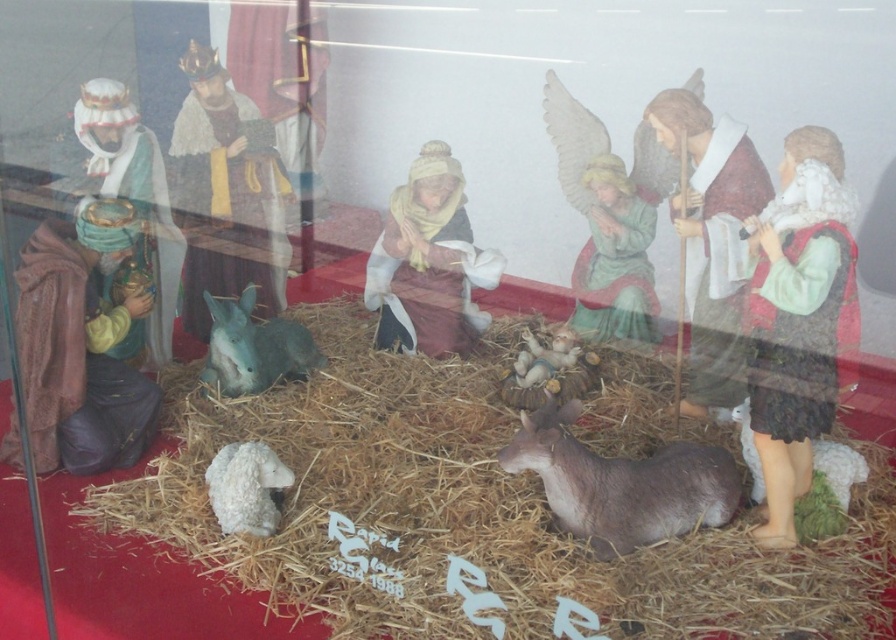
You are a shopkeeper who wants to rearrange the nativity scene in the display case. You need to place the fuzzy brown donkey at lower center and the gray matte donkey at center in a way that they are not overlapping. Which donkey should you move to a higher position?

The gray matte donkey at center should be moved to a higher position because the fuzzy brown donkey at lower center is currently positioned under it, so raising the gray matte donkey would prevent overlap.

You are a customer looking at a nativity scene in a shop window. You notice the white woolen lamb at lower right. Can you determine its exact location within the scene?

The white woolen lamb at lower right is located at point [840,467].

You are a shopkeeper who just received a new nativity set. You need to place the fuzzy brown donkey at lower center and the gray matte donkey at center in their correct positions according to the scene description. Which donkey should be placed to the right side of the other?

The fuzzy brown donkey at lower center should be placed to the right of the gray matte donkey at center because the description states that the fuzzy brown donkey at lower center is to the right of gray matte donkey at center.